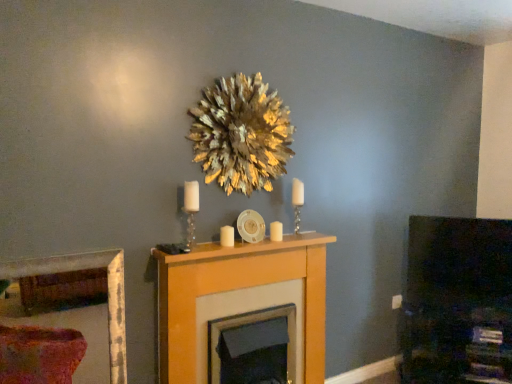
I want to click on vacant point to the right of clear glass candle holder at center, placed as the second candle holder when sorted from back to front, so 210,251.